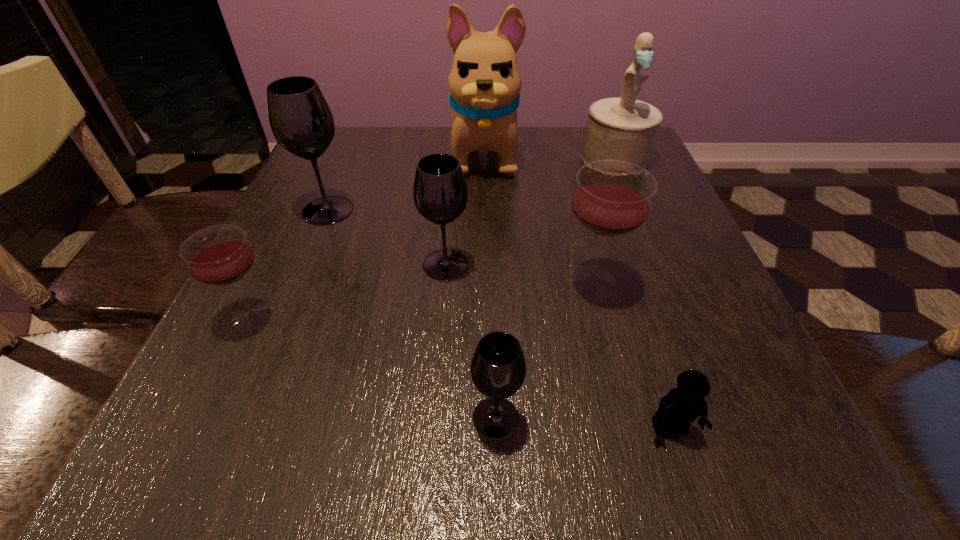
Identify the location of free space at the far edge. Image resolution: width=960 pixels, height=540 pixels. [449, 129].

This screenshot has height=540, width=960. Identify the location of free region at the near edge of the desktop. (647, 416).

Find the location of a particular element. This screenshot has height=540, width=960. free region at the left edge is located at coordinates (293, 248).

Where is `free space at the right edge`? This screenshot has width=960, height=540. free space at the right edge is located at coordinates (666, 201).

Locate an element on the screen. The image size is (960, 540). vacant area at the far left corner of the desktop is located at coordinates (379, 140).

Where is `blank area at the near left corner`? This screenshot has width=960, height=540. blank area at the near left corner is located at coordinates (288, 429).

The width and height of the screenshot is (960, 540). What are the coordinates of `empty space that is in between the second biggest gray wineglass and the farthest gray wineglass` in the screenshot? It's located at (387, 238).

Find the location of a particular element. vacant point located between the second nearest gray wineglass and the fourth wineglass from left to right is located at coordinates click(x=470, y=341).

In order to click on vacant area that lies between the tallest object and the smallest gray wineglass in this screenshot , I will do 491,286.

Where is `free space between the left red wineglass and the nearest gray wineglass`? free space between the left red wineglass and the nearest gray wineglass is located at coordinates (374, 367).